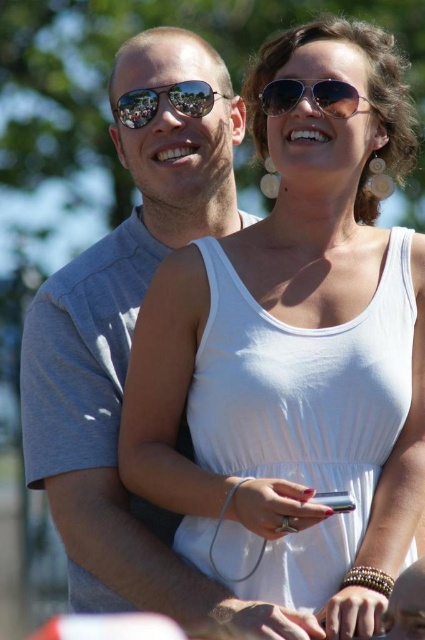
Is shiny reflective sunglasses at upper center below metallic silver phone at lower center?

No, shiny reflective sunglasses at upper center is not below metallic silver phone at lower center.

Does shiny reflective sunglasses at upper center have a smaller size compared to metallic silver phone at lower center?

Actually, shiny reflective sunglasses at upper center might be larger than metallic silver phone at lower center.

Who is more distant from viewer, (206, 92) or (345, 502)?

Positioned behind is point (206, 92).

Where is `shiny reflective sunglasses at upper center`? The image size is (425, 640). shiny reflective sunglasses at upper center is located at coordinates (167, 100).

Is white fabric dress at center taller than metallic silver phone at lower center?

Correct, white fabric dress at center is much taller as metallic silver phone at lower center.

Does white fabric dress at center have a greater width compared to metallic silver phone at lower center?

Indeed, white fabric dress at center has a greater width compared to metallic silver phone at lower center.

What are the coordinates of `white fabric dress at center` in the screenshot? It's located at (275, 340).

Does white fabric dress at center appear over shiny aviator sunglasses at upper center?

No, white fabric dress at center is not above shiny aviator sunglasses at upper center.

The image size is (425, 640). Identify the location of white fabric dress at center. (275, 340).